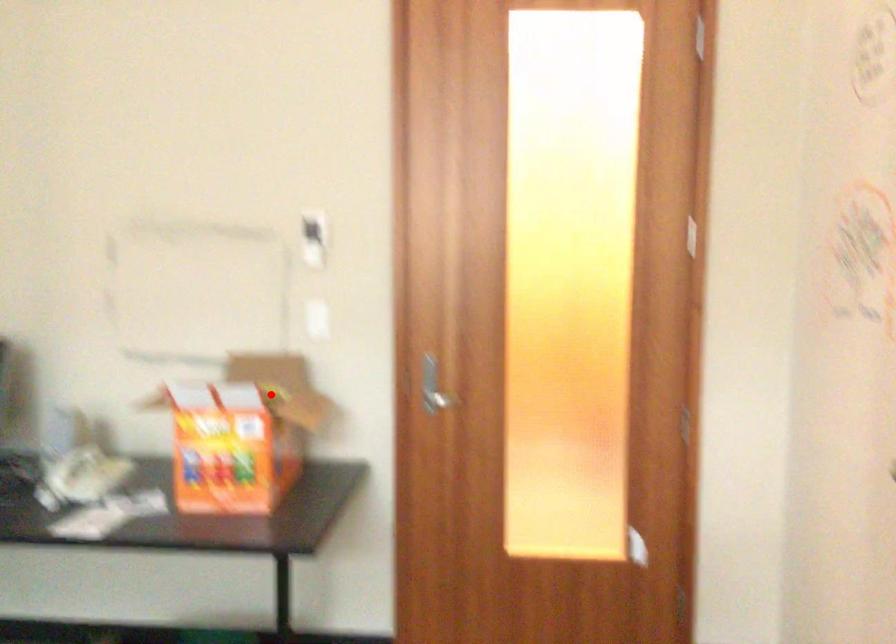
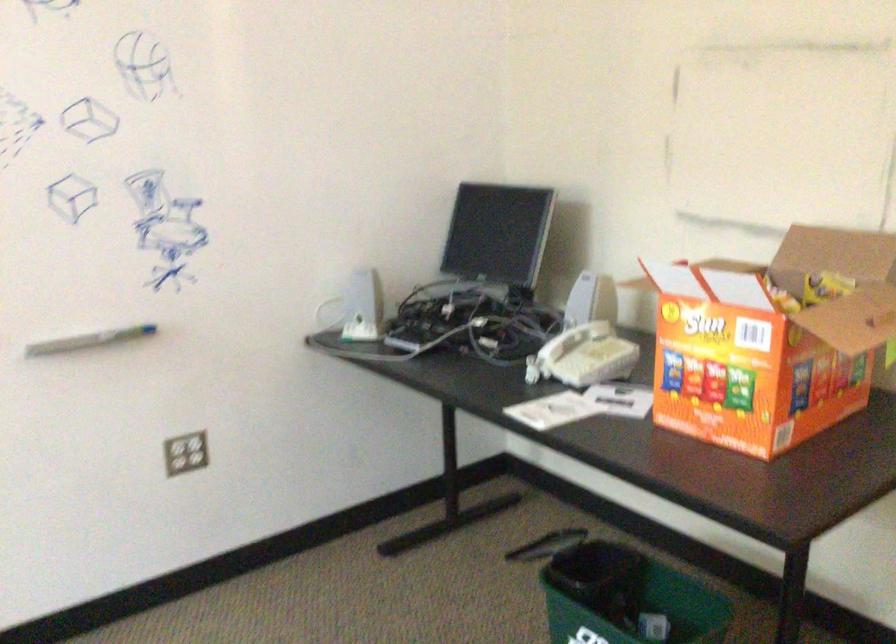
Find the pixel in the second image that matches the highlighted location in the first image.

(824, 287)